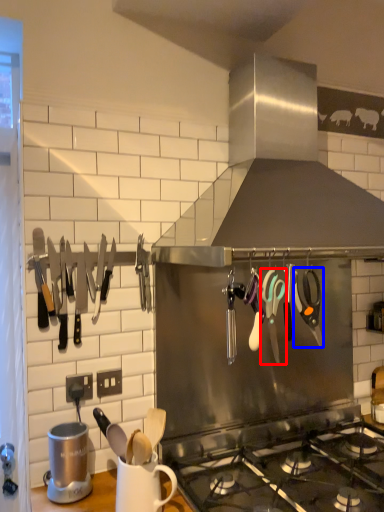
Question: Which object appears farthest to the camera in this image, scissors (highlighted by a red box) or scissors (highlighted by a blue box)?

Choices:
 (A) scissors
 (B) scissors

Answer: (B)